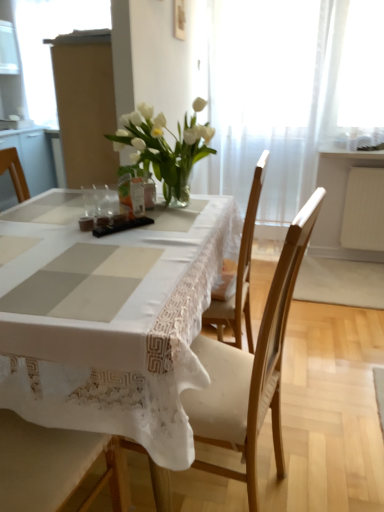
This screenshot has height=512, width=384. I want to click on free space to the right of clear glass vase at center, so click(130, 214).